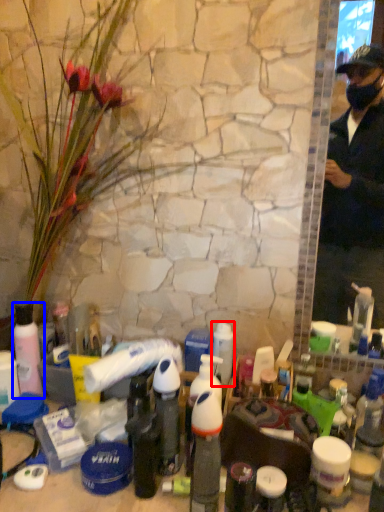
Question: Among these objects, which one is nearest to the camera, toiletry (highlighted by a red box) or bottle (highlighted by a blue box)?

Choices:
 (A) toiletry
 (B) bottle

Answer: (A)